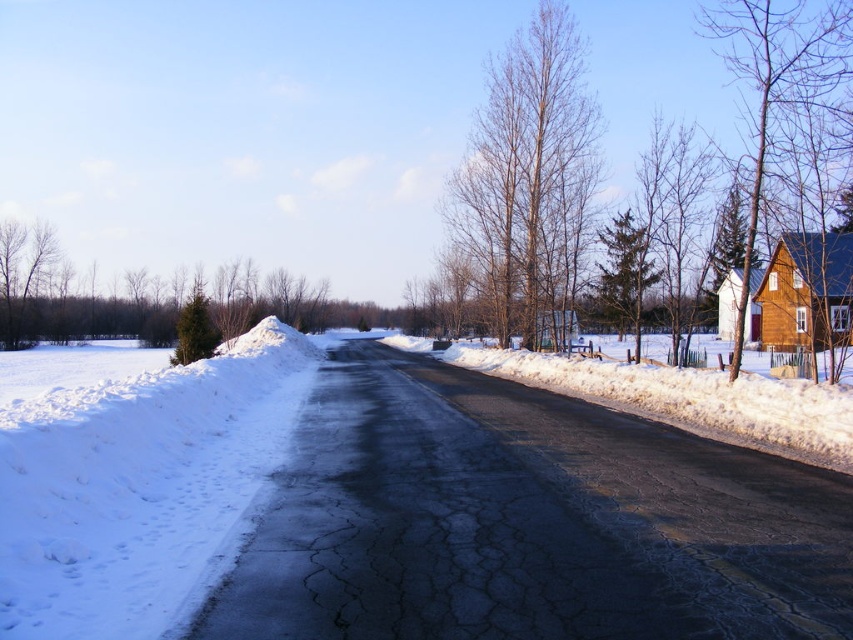
You are a delivery person trying to reach the wooden house on the right side of the road. You notice white fluffy snow at left and green textured pine at left. Which object should you avoid stepping on to prevent sinking into the snow?

You should avoid stepping on the white fluffy snow at left because it is in front of the green textured pine at left, meaning it is closer to you and more likely to be deep snow where you might sink.